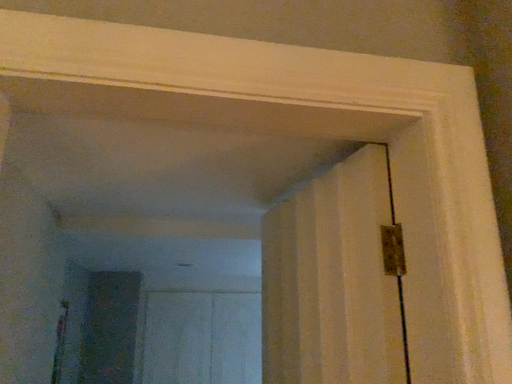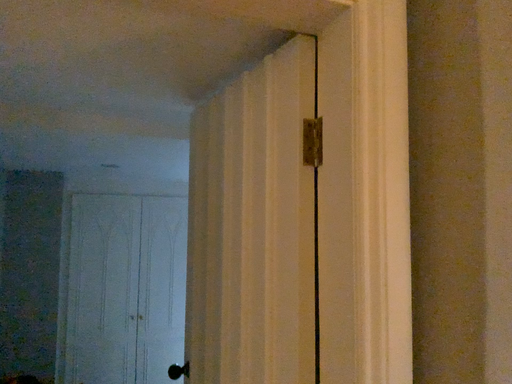
Question: Which way did the camera rotate in the video?

Choices:
 (A) rotated right
 (B) rotated left

Answer: (A)